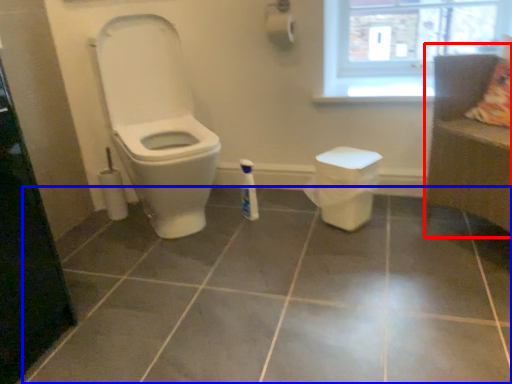
Question: Which object is further to the camera taking this photo, couch (highlighted by a red box) or ceramic tile (highlighted by a blue box)?

Choices:
 (A) couch
 (B) ceramic tile

Answer: (A)